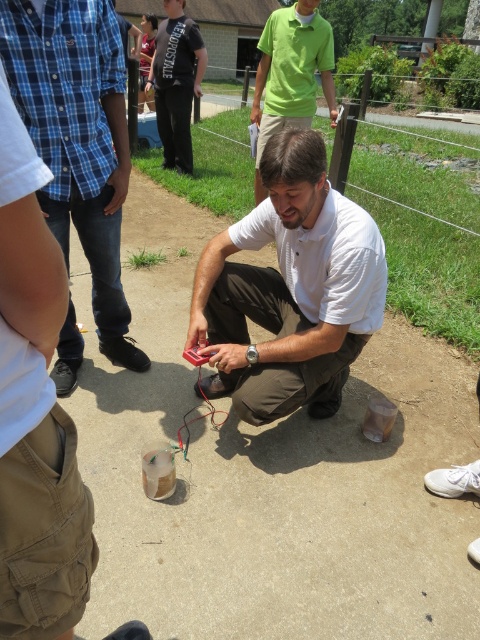
Where is `blue plaid shirt at left`? blue plaid shirt at left is located at coordinates (78, 138).

In the scene shown: Is blue plaid shirt at left taller than green cotton shirt at center?

Indeed, blue plaid shirt at left has a greater height compared to green cotton shirt at center.

Between point (95, 321) and point (279, 52), which one is positioned in front?

Positioned in front is point (95, 321).

Image resolution: width=480 pixels, height=640 pixels. What are the coordinates of `blue plaid shirt at left` in the screenshot? It's located at (78, 138).

Is white matte shirt at center wider than green cotton shirt at center?

Yes.

Is white matte shirt at center positioned at the back of green cotton shirt at center?

No, it is not.

Image resolution: width=480 pixels, height=640 pixels. Identify the location of white matte shirt at center. (289, 291).

Locate an element on the screen. Image resolution: width=480 pixels, height=640 pixels. white matte shirt at center is located at coordinates (289, 291).

What do you see at coordinates (289, 291) in the screenshot?
I see `white matte shirt at center` at bounding box center [289, 291].

Does point (244, 346) lie in front of point (201, 51)?

Yes.

The image size is (480, 640). In order to click on white matte shirt at center in this screenshot , I will do `click(289, 291)`.